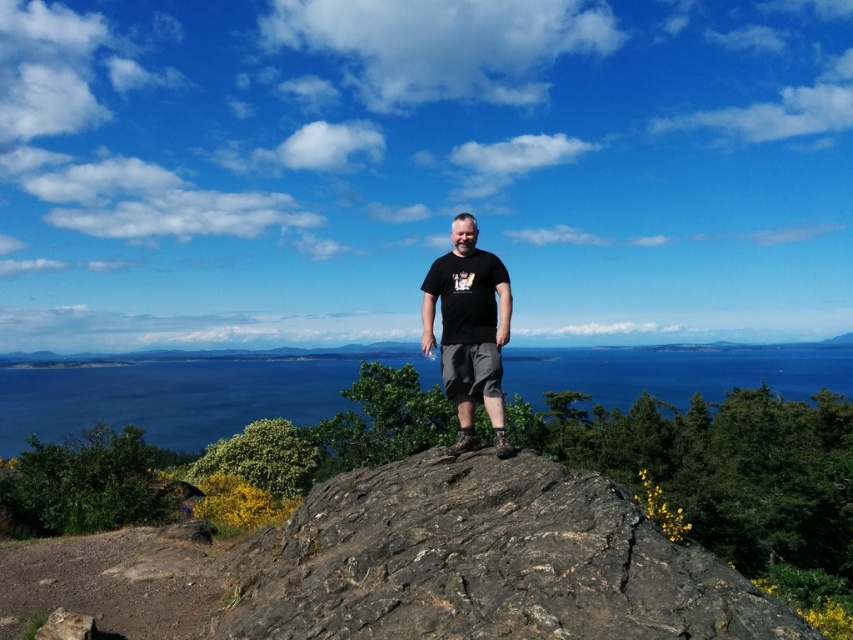
Question: Can you confirm if rough textured rock at center is smaller than black matte t-shirt at center?

Choices:
 (A) yes
 (B) no

Answer: (A)

Question: Can you confirm if rough textured rock at center is bigger than black matte t-shirt at center?

Choices:
 (A) no
 (B) yes

Answer: (A)

Question: Does rough textured rock at center appear on the left side of black matte t-shirt at center?

Choices:
 (A) yes
 (B) no

Answer: (A)

Question: Which of the following is the closest to the observer?

Choices:
 (A) rough textured rock at center
 (B) black matte t-shirt at center

Answer: (A)